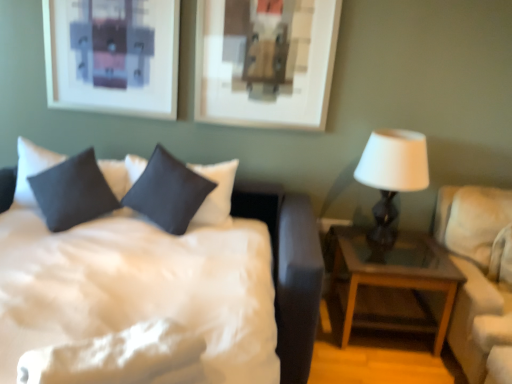
Question: Is white matte table lamp at right positioned with its back to white satin bed at center?

Choices:
 (A) no
 (B) yes

Answer: (A)

Question: Considering the relative positions of white matte table lamp at right and white satin bed at center in the image provided, is white matte table lamp at right behind white satin bed at center?

Choices:
 (A) no
 (B) yes

Answer: (B)

Question: From a real-world perspective, is white matte table lamp at right physically above white satin bed at center?

Choices:
 (A) yes
 (B) no

Answer: (A)

Question: From the image's perspective, is white matte table lamp at right on top of white satin bed at center?

Choices:
 (A) yes
 (B) no

Answer: (A)

Question: From the image's perspective, would you say white matte table lamp at right is shown under white satin bed at center?

Choices:
 (A) yes
 (B) no

Answer: (B)

Question: Can you confirm if white matte table lamp at right is wider than white satin bed at center?

Choices:
 (A) no
 (B) yes

Answer: (A)

Question: Is beige fabric couch at right completely or partially inside white satin bed at center?

Choices:
 (A) no
 (B) yes

Answer: (A)

Question: Is white satin bed at center directly adjacent to beige fabric couch at right?

Choices:
 (A) no
 (B) yes

Answer: (A)

Question: From a real-world perspective, is white satin bed at center beneath beige fabric couch at right?

Choices:
 (A) yes
 (B) no

Answer: (A)

Question: Is white satin bed at center completely or partially outside of beige fabric couch at right?

Choices:
 (A) yes
 (B) no

Answer: (A)

Question: Is white satin bed at center taller than beige fabric couch at right?

Choices:
 (A) yes
 (B) no

Answer: (B)

Question: From the image's perspective, is white satin bed at center on beige fabric couch at right?

Choices:
 (A) no
 (B) yes

Answer: (A)

Question: From a real-world perspective, does beige fabric couch at right stand above satin dark blue pillow at center, placed as the 1th pillow when sorted from right to left?

Choices:
 (A) no
 (B) yes

Answer: (A)